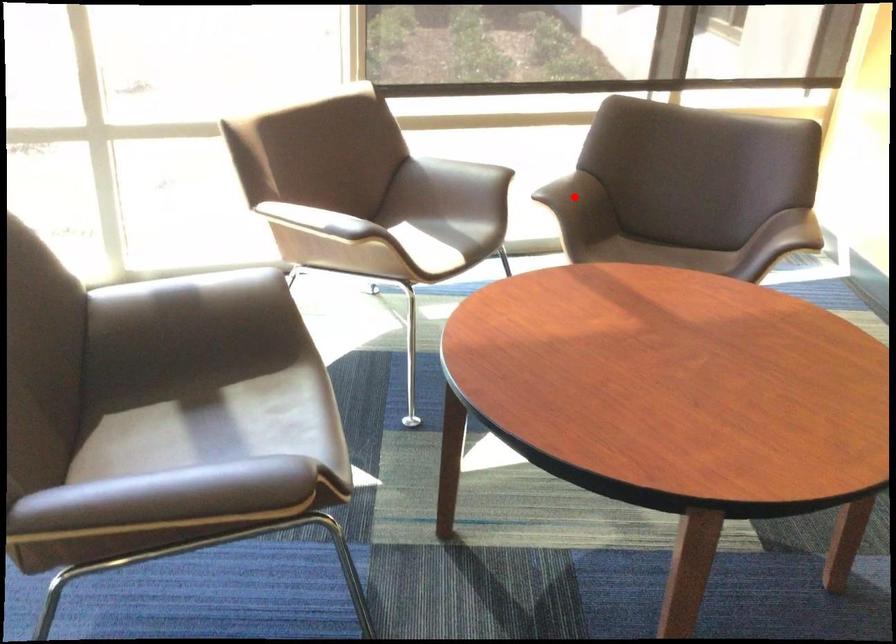
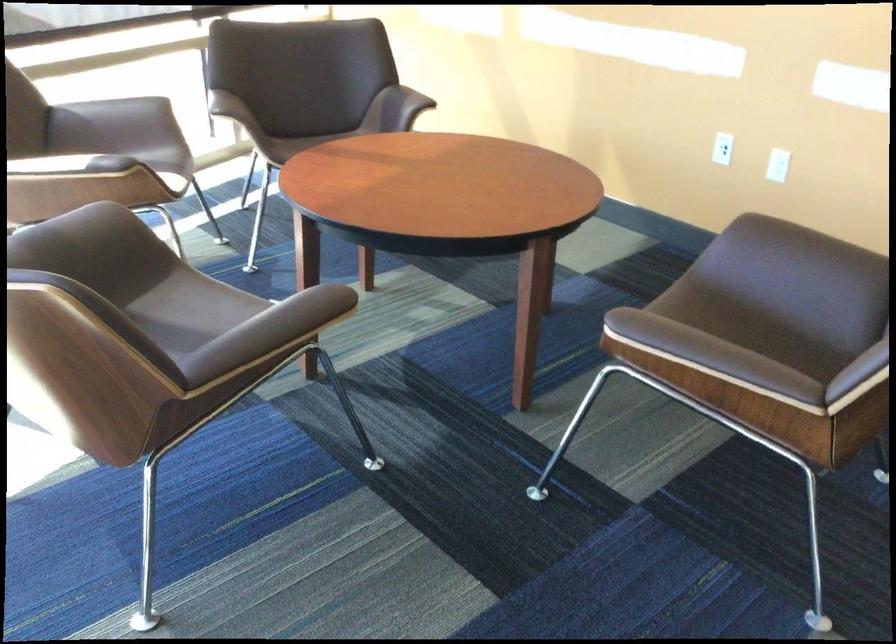
Question: I am providing you with two images of the same scene from different viewpoints. A red point is marked on the first image. Is the red point's position out of view in image 2?

Choices:
 (A) Yes
 (B) No

Answer: (A)